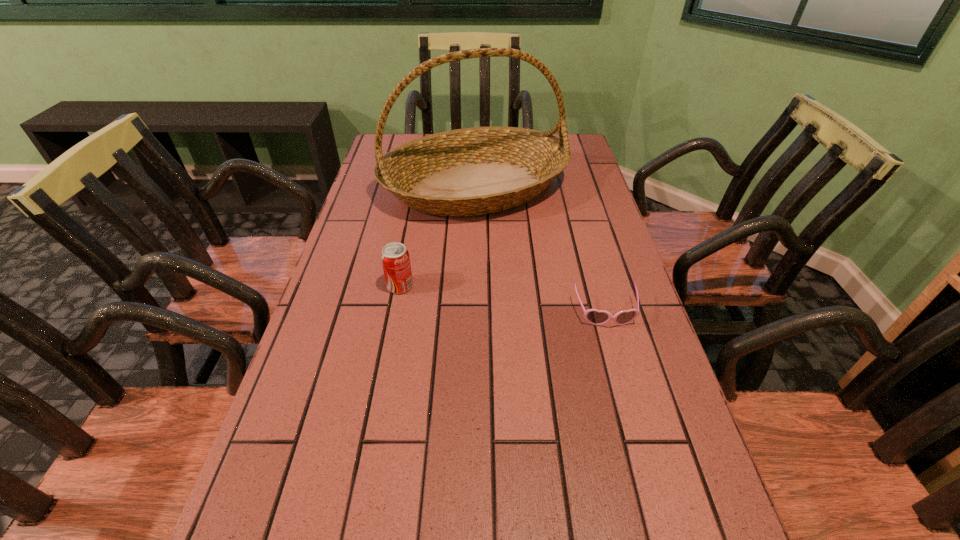
Locate an element on the screen. basket that is at the left edge is located at coordinates (474, 171).

You are a GUI agent. You are given a task and a screenshot of the screen. Output one action in this format:
    pyautogui.click(x=<x>, y=<y>)
    Task: Click on the soda can that is positioned at the left edge
    This screenshot has height=540, width=960.
    Given the screenshot: What is the action you would take?
    pyautogui.click(x=395, y=258)

This screenshot has width=960, height=540. In order to click on basket that is at the right edge in this screenshot , I will do `click(474, 171)`.

Locate an element on the screen. sunglasses situated at the right edge is located at coordinates (593, 316).

Identify the location of object positioned at the far left corner. The width and height of the screenshot is (960, 540). (474, 171).

Locate an element on the screen. The width and height of the screenshot is (960, 540). object present at the far right corner is located at coordinates (474, 171).

The height and width of the screenshot is (540, 960). In the image, there is a desktop. Identify the location of free space at the left edge. (387, 193).

In the image, there is a desktop. Identify the location of vacant space at the right edge. This screenshot has height=540, width=960. (585, 251).

Identify the location of vacant area at the far left corner of the desktop. The height and width of the screenshot is (540, 960). (400, 141).

Where is `free space that is in between the shortest object and the tallest object`? This screenshot has width=960, height=540. free space that is in between the shortest object and the tallest object is located at coordinates (540, 250).